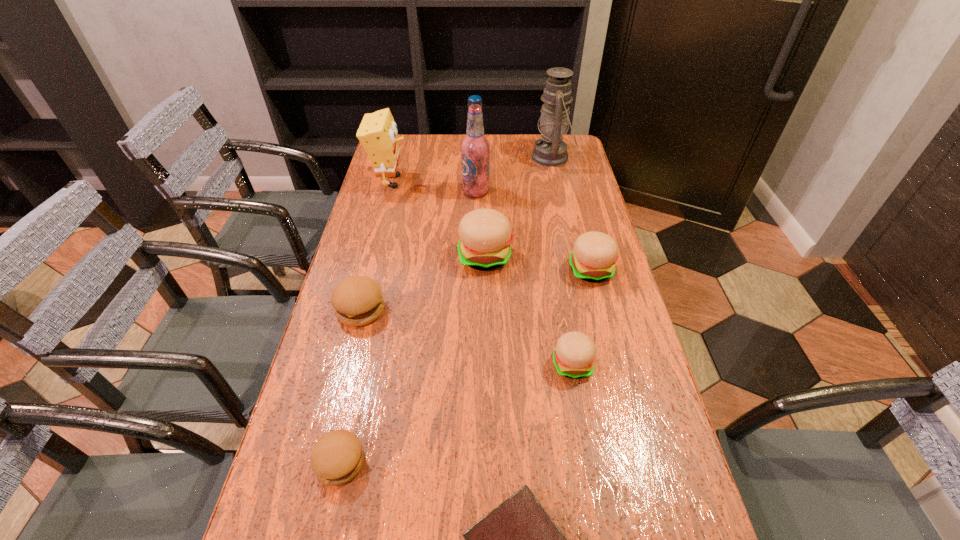
This screenshot has width=960, height=540. In order to click on vacant position at the far right corner of the desktop in this screenshot , I will do `click(578, 147)`.

I want to click on free spot between the third nearest hamburger and the third tallest object, so point(375,245).

Locate an element on the screen. free point between the biggest beige hamburger and the sixth farthest object is located at coordinates (423, 283).

Where is `free spot between the blue alcohol and the smaller brown hamburger`? The height and width of the screenshot is (540, 960). free spot between the blue alcohol and the smaller brown hamburger is located at coordinates (408, 327).

The width and height of the screenshot is (960, 540). Find the location of `vacant area that lies between the fourth farthest hamburger and the oil lamp`. vacant area that lies between the fourth farthest hamburger and the oil lamp is located at coordinates (562, 261).

Locate an element on the screen. The width and height of the screenshot is (960, 540). unoccupied area between the third nearest object and the bigger brown hamburger is located at coordinates (467, 337).

The height and width of the screenshot is (540, 960). I want to click on free spot between the nearest beige hamburger and the alcohol, so click(x=524, y=278).

The image size is (960, 540). I want to click on free space between the alcohol and the sponge, so point(433,187).

At what (x,y) coordinates should I click in order to perform the action: click on object that ranks as the fourth closest to the second tallest hamburger. Please return your answer as a coordinate pair (x, y). Looking at the image, I should click on (551, 151).

Locate which object is the third closest to the bigger brown hamburger. Please provide its 2D coordinates. Your answer should be formatted as a tuple, i.e. [(x, y)], where the tuple contains the x and y coordinates of a point satisfying the conditions above.

[(574, 355)]